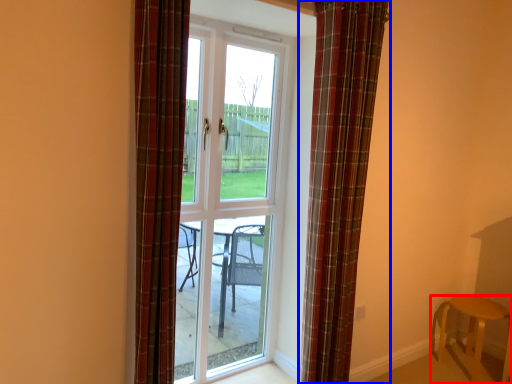
Question: Which object is further to the camera taking this photo, furniture (highlighted by a red box) or curtain (highlighted by a blue box)?

Choices:
 (A) furniture
 (B) curtain

Answer: (A)